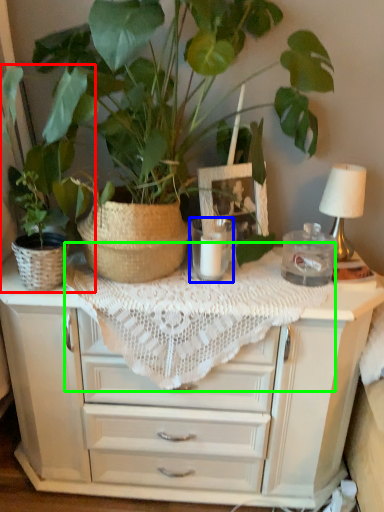
Question: Which object is positioned closest to houseplant (highlighted by a red box)? Select from candle holder (highlighted by a blue box) and tablecloth (highlighted by a green box).

Choices:
 (A) candle holder
 (B) tablecloth

Answer: (B)